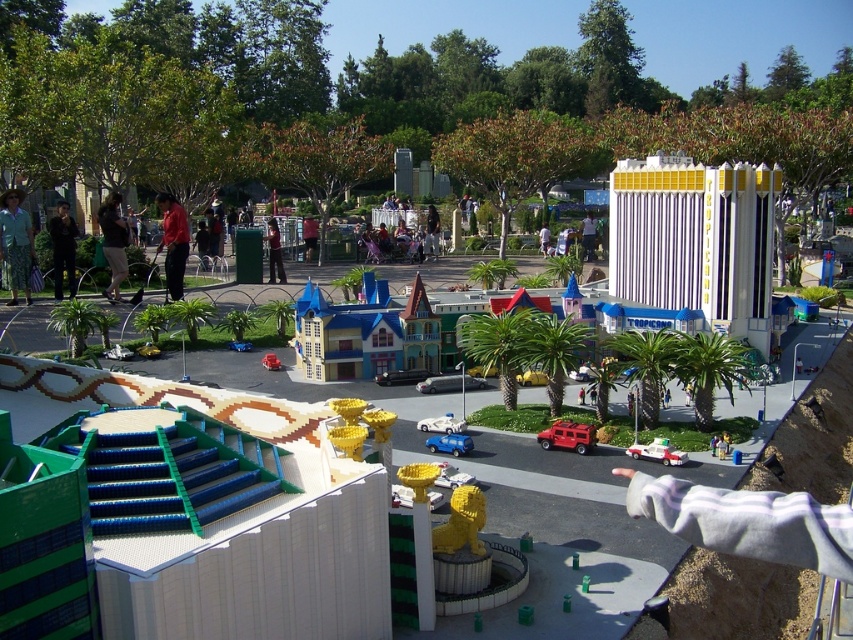
Question: From the image, what is the correct spatial relationship of dark blue jeans at left in relation to blue plastic car at center?

Choices:
 (A) above
 (B) below

Answer: (A)

Question: Does camouflage pants at left appear on the right side of dark blue jeans at center?

Choices:
 (A) no
 (B) yes

Answer: (A)

Question: Which point is farther to the camera?

Choices:
 (A) (267, 221)
 (B) (115, 256)
 (C) (550, 428)

Answer: (A)

Question: Which of the following is the closest to the observer?

Choices:
 (A) (68, 243)
 (B) (120, 230)
 (C) (660, 456)
 (D) (161, 244)

Answer: (C)

Question: From the image, what is the correct spatial relationship of dark blue jeans at left in relation to red plastic fire truck at center?

Choices:
 (A) above
 (B) below

Answer: (A)

Question: Which point is farther from the camera taking this photo?

Choices:
 (A) (180, 218)
 (B) (53, 262)

Answer: (A)